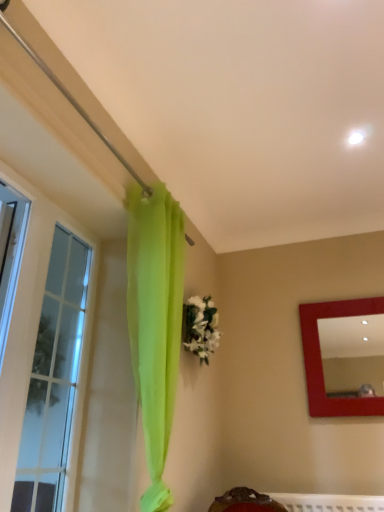
Question: Does white matte floral arrangement at center lie behind matte red mirror at upper right?

Choices:
 (A) no
 (B) yes

Answer: (A)

Question: From the image's perspective, would you say white matte floral arrangement at center is positioned over matte red mirror at upper right?

Choices:
 (A) no
 (B) yes

Answer: (B)

Question: Does white matte floral arrangement at center appear on the right side of matte red mirror at upper right?

Choices:
 (A) no
 (B) yes

Answer: (A)

Question: Could you tell me if white matte floral arrangement at center is turned towards matte red mirror at upper right?

Choices:
 (A) no
 (B) yes

Answer: (A)

Question: Considering the relative sizes of white matte floral arrangement at center and matte red mirror at upper right in the image provided, is white matte floral arrangement at center wider than matte red mirror at upper right?

Choices:
 (A) yes
 (B) no

Answer: (A)

Question: Is the position of white matte floral arrangement at center less distant than that of matte red mirror at upper right?

Choices:
 (A) no
 (B) yes

Answer: (B)

Question: Considering the relative sizes of white matte floral arrangement at center and clear glass window at left in the image provided, is white matte floral arrangement at center taller than clear glass window at left?

Choices:
 (A) no
 (B) yes

Answer: (A)

Question: Are white matte floral arrangement at center and clear glass window at left beside each other?

Choices:
 (A) yes
 (B) no

Answer: (B)

Question: Does white matte floral arrangement at center turn towards clear glass window at left?

Choices:
 (A) yes
 (B) no

Answer: (B)

Question: Is white matte floral arrangement at center positioned in front of clear glass window at left?

Choices:
 (A) yes
 (B) no

Answer: (B)

Question: Is white matte floral arrangement at center behind clear glass window at left?

Choices:
 (A) no
 (B) yes

Answer: (B)

Question: Is white matte floral arrangement at center to the left of clear glass window at left from the viewer's perspective?

Choices:
 (A) no
 (B) yes

Answer: (A)

Question: Is matte red mirror at upper right completely or partially outside of clear glass window at left?

Choices:
 (A) yes
 (B) no

Answer: (A)